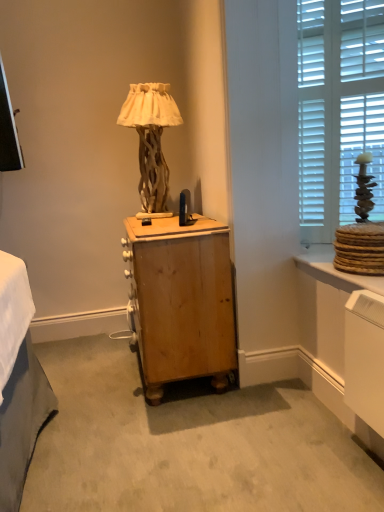
Image resolution: width=384 pixels, height=512 pixels. I want to click on free space in front of wooden nightstand at center, so click(170, 438).